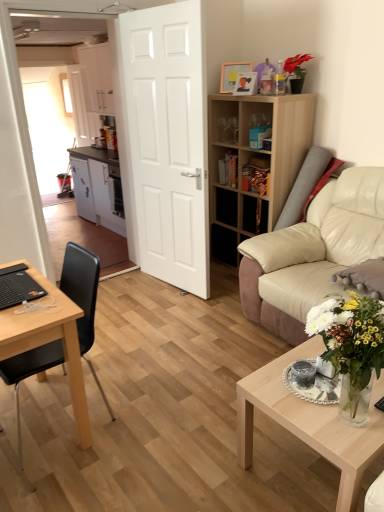
Question: Is point (92, 156) positioned closer to the camera than point (244, 196)?

Choices:
 (A) closer
 (B) farther

Answer: (B)

Question: Looking at the image, does white matte cabinet at left, acting as the 1th cabinetry starting from the bottom, seem bigger or smaller compared to wooden bookshelf at right?

Choices:
 (A) big
 (B) small

Answer: (B)

Question: Which of these objects is positioned farthest from the beige leather couch at right?

Choices:
 (A) wooden picture frame at upper center, marked as the second picture frame in a front-to-back arrangement
 (B) black plastic chair at left
 (C) white glossy vase at lower right
 (D) white matte cabinet at center, which is the second cabinetry from bottom to top
 (E) wooden picture frame at upper center, acting as the first picture frame starting from the front

Answer: (D)

Question: Which object is the farthest from the white matte cabinet at left, acting as the 1th cabinetry starting from the bottom?

Choices:
 (A) beige leather couch at right
 (B) white glossy vase at lower right
 (C) wooden picture frame at upper center, the second picture frame when ordered from back to front
 (D) wooden picture frame at upper center, marked as the second picture frame in a front-to-back arrangement
 (E) wooden bookshelf at right

Answer: (B)